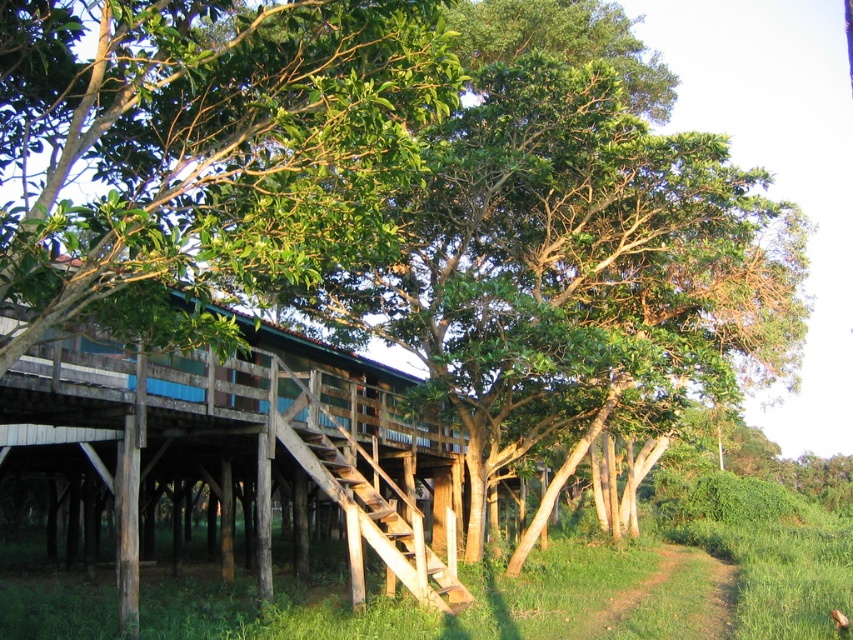
You are a delivery person carrying a heavy package and need to reach the entrance of the house. You see the green grassy path at lower right and the wooden stairs at center. Which path should you take to avoid carrying the package too far?

The green grassy path at lower right has a larger size compared to wooden stairs at center, so taking the green grassy path at lower right would be shorter and require less effort to reach the entrance.

You are standing at the base of the structure and want to reach the entrance. Which path should you take, the green grassy path at lower right or the wooden stairs at center, and why?

You should take the wooden stairs at center because the green grassy path at lower right is closer to the viewer but does not lead to the entrance. The wooden stairs at center are the correct path leading up to the entrance.

You are a delivery person trying to reach the wooden hut at center. The wooden stairs at center are the only path to it. Can you carry a large package up the stairs if the stairs can only support items smaller than the stairs themselves?

The wooden hut at center is larger in size than wooden stairs at center. Since the wooden stairs at center are smaller than the hut, they might not be able to support a large package. It is safer to check the stairs capacity before attempting to carry the package.